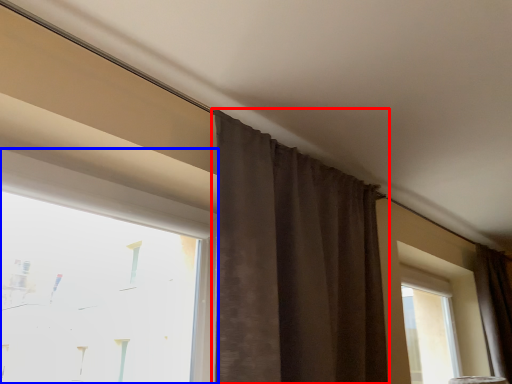
Question: Among these objects, which one is farthest to the camera, curtain (highlighted by a red box) or window (highlighted by a blue box)?

Choices:
 (A) curtain
 (B) window

Answer: (A)